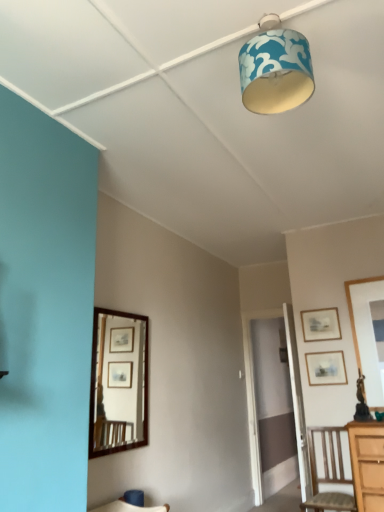
Question: Does matte wooden picture frame at right, positioned as the 2th picture frame in top-to-bottom order, appear on the left side of wooden picture frame at upper right, the second picture frame ordered from the bottom?

Choices:
 (A) yes
 (B) no

Answer: (B)

Question: Is matte wooden picture frame at right, the 1th picture frame ordered from the bottom, in front of wooden picture frame at upper right, positioned as the first picture frame in top-to-bottom order?

Choices:
 (A) no
 (B) yes

Answer: (B)

Question: Is matte wooden picture frame at right, the 1th picture frame ordered from the bottom, not inside wooden picture frame at upper right, positioned as the first picture frame in top-to-bottom order?

Choices:
 (A) no
 (B) yes

Answer: (B)

Question: Can you confirm if matte wooden picture frame at right, the 1th picture frame ordered from the bottom, is shorter than wooden picture frame at upper right, positioned as the first picture frame in top-to-bottom order?

Choices:
 (A) yes
 (B) no

Answer: (B)

Question: Can wooden picture frame at upper right, the second picture frame ordered from the bottom, be found inside matte wooden picture frame at right, the 1th picture frame ordered from the bottom?

Choices:
 (A) no
 (B) yes

Answer: (A)

Question: Considering the positions of point (311, 81) and point (322, 357), is point (311, 81) closer or farther from the camera than point (322, 357)?

Choices:
 (A) closer
 (B) farther

Answer: (A)

Question: Is blue fabric lampshade at upper center bigger or smaller than matte wooden picture frame at right, positioned as the 2th picture frame in top-to-bottom order?

Choices:
 (A) small
 (B) big

Answer: (B)

Question: Looking at their shapes, would you say blue fabric lampshade at upper center is wider or thinner than matte wooden picture frame at right, positioned as the 2th picture frame in top-to-bottom order?

Choices:
 (A) wide
 (B) thin

Answer: (A)

Question: Is blue fabric lampshade at upper center taller or shorter than matte wooden picture frame at right, positioned as the 2th picture frame in top-to-bottom order?

Choices:
 (A) short
 (B) tall

Answer: (B)

Question: Is point (316, 476) closer or farther from the camera than point (281, 51)?

Choices:
 (A) closer
 (B) farther

Answer: (B)

Question: Is wooden chair at lower right inside the boundaries of blue fabric lampshade at upper center, or outside?

Choices:
 (A) outside
 (B) inside

Answer: (A)

Question: Relative to blue fabric lampshade at upper center, is wooden chair at lower right in front or behind?

Choices:
 (A) behind
 (B) front

Answer: (A)

Question: Considering the positions of wooden chair at lower right and blue fabric lampshade at upper center in the image, is wooden chair at lower right wider or thinner than blue fabric lampshade at upper center?

Choices:
 (A) thin
 (B) wide

Answer: (B)

Question: Is blue fabric lampshade at upper center wider or thinner than wooden chair at lower right?

Choices:
 (A) wide
 (B) thin

Answer: (B)

Question: From the image's perspective, is blue fabric lampshade at upper center above or below wooden chair at lower right?

Choices:
 (A) above
 (B) below

Answer: (A)